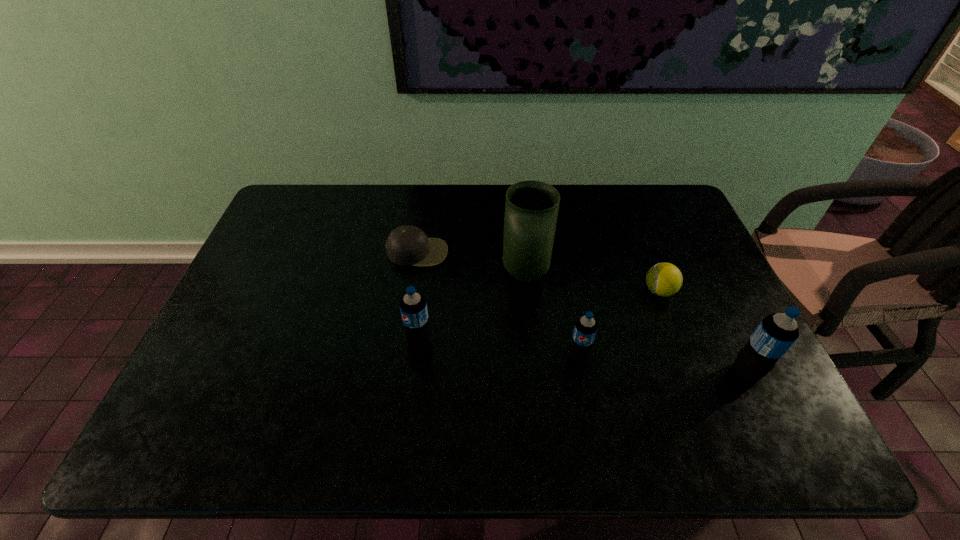
Where is `the third tallest object`? The image size is (960, 540). the third tallest object is located at coordinates point(413,307).

Where is `the leftmost soda bottle`? The width and height of the screenshot is (960, 540). the leftmost soda bottle is located at coordinates (413, 307).

This screenshot has width=960, height=540. Identify the location of the fourth object from left to right. (585, 328).

Find the location of a particular element. Image resolution: width=960 pixels, height=540 pixels. the fourth tallest object is located at coordinates (585, 328).

Find the location of `the rightmost soda bottle`. the rightmost soda bottle is located at coordinates (776, 333).

You are a GUI agent. You are given a task and a screenshot of the screen. Output one action in this format:
    pyautogui.click(x=<x>, y=<y>)
    Task: Click on the cap
    Image resolution: width=960 pixels, height=540 pixels.
    Given the screenshot: What is the action you would take?
    pyautogui.click(x=406, y=245)

Locate an element on the screen. This screenshot has height=540, width=960. tennis ball is located at coordinates (663, 279).

Identify the location of the fourth object from right to left. (531, 208).

Locate an element on the screen. Image resolution: width=960 pixels, height=540 pixels. the tallest object is located at coordinates (531, 208).

This screenshot has height=540, width=960. Find the location of `free space located 0.260m on the back of the leftmost soda bottle`. free space located 0.260m on the back of the leftmost soda bottle is located at coordinates (428, 261).